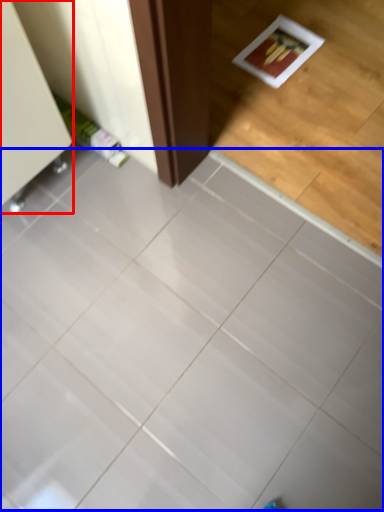
Question: Which of the following is the farthest to the observer, furniture (highlighted by a red box) or ceramic tile (highlighted by a blue box)?

Choices:
 (A) furniture
 (B) ceramic tile

Answer: (A)